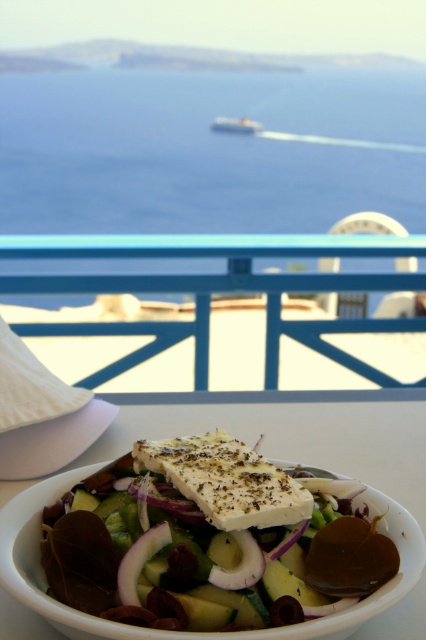
Question: Is blue water at center above blue painted wood rail at upper center?

Choices:
 (A) yes
 (B) no

Answer: (A)

Question: Which point is farther from the camera taking this photo?

Choices:
 (A) (336, 276)
 (B) (310, 209)

Answer: (B)

Question: Is white ceramic bowl at center smaller than metallic silver boat at upper center?

Choices:
 (A) no
 (B) yes

Answer: (A)

Question: Which object is closer to the camera taking this photo?

Choices:
 (A) metallic silver boat at upper center
 (B) blue water at center

Answer: (B)

Question: Does blue painted wood rail at upper center appear under white ceramic bowl at center?

Choices:
 (A) no
 (B) yes

Answer: (A)

Question: Which point is farther from the camera taking this photo?

Choices:
 (A) (291, 81)
 (B) (236, 124)

Answer: (B)